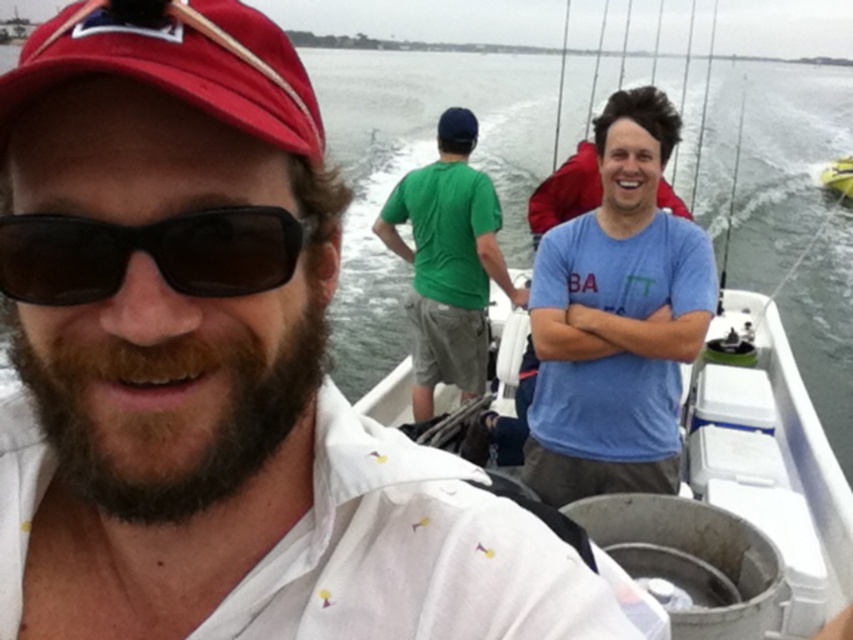
Question: Which point appears closest to the camera in this image?

Choices:
 (A) (283, 138)
 (B) (633, 90)
 (C) (99, 250)

Answer: (A)

Question: Does blue cotton t-shirt at center have a larger size compared to red fabric cap at upper left?

Choices:
 (A) yes
 (B) no

Answer: (A)

Question: Is green cotton shirt at center above blue cotton shirt at upper right?

Choices:
 (A) yes
 (B) no

Answer: (B)

Question: Which point is farther to the camera?

Choices:
 (A) blue cotton shirt at upper right
 (B) green cotton shirt at center
 (C) blue cotton t-shirt at center
 (D) white plastic boat at center

Answer: (A)

Question: Is blue cotton t-shirt at center wider than red fabric cap at upper left?

Choices:
 (A) yes
 (B) no

Answer: (B)

Question: Which point appears farthest from the camera in this image?

Choices:
 (A) (492, 269)
 (B) (215, 45)
 (C) (735, 465)

Answer: (A)